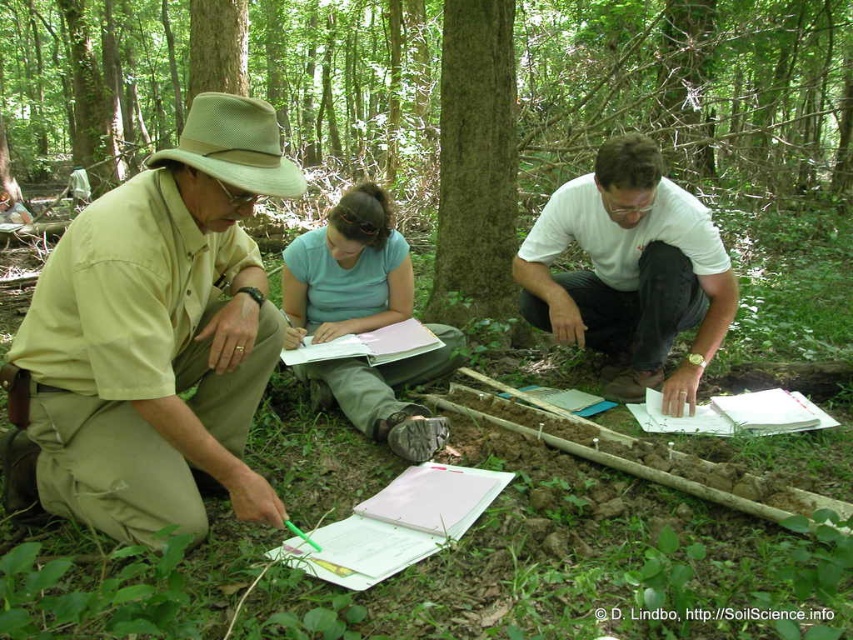
Question: Considering the relative positions of white matte shirt at center and white paper clipboard at center in the image provided, where is white matte shirt at center located with respect to white paper clipboard at center?

Choices:
 (A) right
 (B) left

Answer: (A)

Question: Can you confirm if khaki cotton shirt at center is thinner than white matte shirt at center?

Choices:
 (A) yes
 (B) no

Answer: (B)

Question: Among these objects, which one is farthest from the camera?

Choices:
 (A) khaki cotton shirt at center
 (B) white matte shirt at center
 (C) white paper clipboard at center

Answer: (B)

Question: Which point is closer to the camera?

Choices:
 (A) light blue cotton shirt at center
 (B) white paper clipboard at center

Answer: (B)

Question: Considering the relative positions of khaki cotton shirt at center and green rough bark tree at center in the image provided, where is khaki cotton shirt at center located with respect to green rough bark tree at center?

Choices:
 (A) below
 (B) above

Answer: (A)

Question: Which point is farther to the camera?

Choices:
 (A) white matte shirt at center
 (B) green rough bark tree at center
 (C) white paper clipboard at center

Answer: (B)